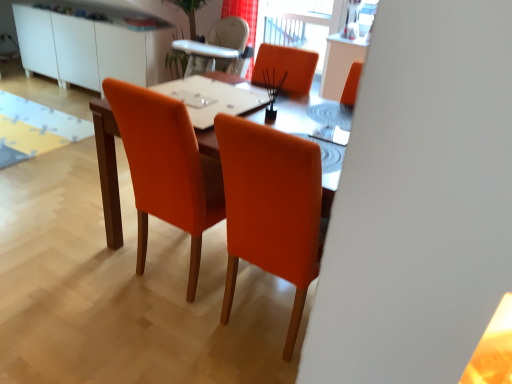
Question: Considering the relative sizes of white glossy table at center and orange fabric chair at center in the image provided, is white glossy table at center wider than orange fabric chair at center?

Choices:
 (A) no
 (B) yes

Answer: (B)

Question: Is white glossy table at center closer to camera compared to orange fabric chair at center?

Choices:
 (A) yes
 (B) no

Answer: (B)

Question: From a real-world perspective, is white glossy table at center located higher than orange fabric chair at center?

Choices:
 (A) no
 (B) yes

Answer: (B)

Question: Does white glossy table at center appear on the left side of orange fabric chair at center?

Choices:
 (A) no
 (B) yes

Answer: (A)

Question: Is white glossy table at center outside orange fabric chair at center?

Choices:
 (A) yes
 (B) no

Answer: (B)

Question: Is there a large distance between white glossy table at center and orange fabric chair at center?

Choices:
 (A) yes
 (B) no

Answer: (B)

Question: Would you say orange fabric chair at center is part of red fabric curtain at upper center's contents?

Choices:
 (A) yes
 (B) no

Answer: (B)

Question: Considering the relative sizes of red fabric curtain at upper center and orange fabric chair at center in the image provided, is red fabric curtain at upper center smaller than orange fabric chair at center?

Choices:
 (A) yes
 (B) no

Answer: (A)

Question: Considering the relative positions of red fabric curtain at upper center and orange fabric chair at center in the image provided, is red fabric curtain at upper center to the left of orange fabric chair at center from the viewer's perspective?

Choices:
 (A) no
 (B) yes

Answer: (A)

Question: Is red fabric curtain at upper center thinner than orange fabric chair at center?

Choices:
 (A) yes
 (B) no

Answer: (A)

Question: Considering the relative sizes of red fabric curtain at upper center and orange fabric chair at center in the image provided, is red fabric curtain at upper center bigger than orange fabric chair at center?

Choices:
 (A) no
 (B) yes

Answer: (A)

Question: Is red fabric curtain at upper center placed right next to orange fabric chair at center?

Choices:
 (A) no
 (B) yes

Answer: (A)

Question: Is transparent glass window screen at upper center not near white glossy cabinet at upper left?

Choices:
 (A) no
 (B) yes

Answer: (B)